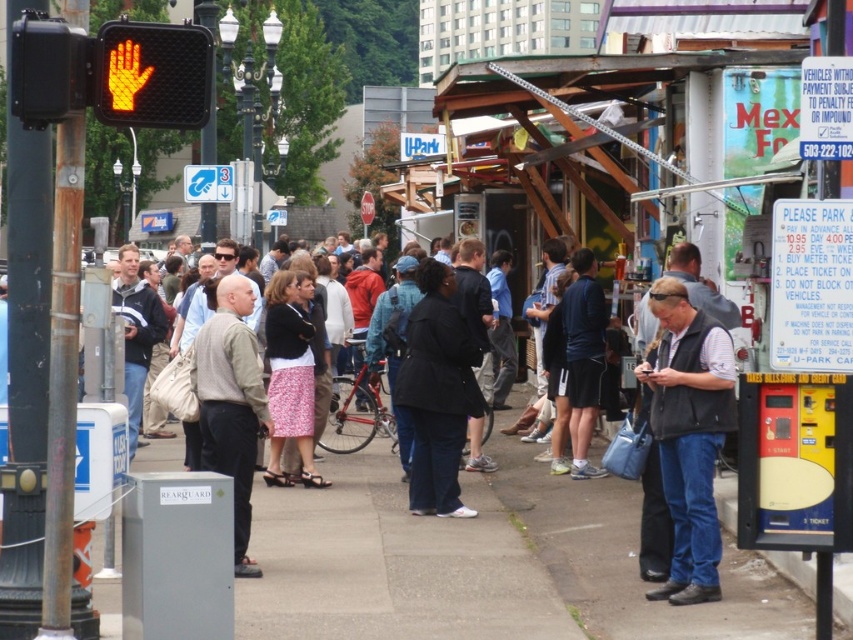
Question: Can you confirm if matte black jacket at center is bigger than dark blue jersey at center?

Choices:
 (A) no
 (B) yes

Answer: (B)

Question: Which of these objects is positioned closest to the dark gray vest at center?

Choices:
 (A) orange matte traffic light at upper left
 (B) black plastic traffic light at upper left
 (C) black matte jacket at center
 (D) matte black jacket at center

Answer: (C)

Question: Which object is positioned closest to the black plastic traffic light at upper left?

Choices:
 (A) dark blue jersey at center
 (B) light brown sweater at center
 (C) dark gray vest at center
 (D) black matte jacket at center

Answer: (B)

Question: Is dark gray vest at center to the left of black plastic traffic light at upper left from the viewer's perspective?

Choices:
 (A) yes
 (B) no

Answer: (B)

Question: Is dark gray vest at center positioned in front of light brown sweater at center?

Choices:
 (A) no
 (B) yes

Answer: (B)

Question: Which of the following is the farthest from the observer?

Choices:
 (A) light brown sweater at center
 (B) matte black jacket at center
 (C) dark blue jersey at center

Answer: (C)